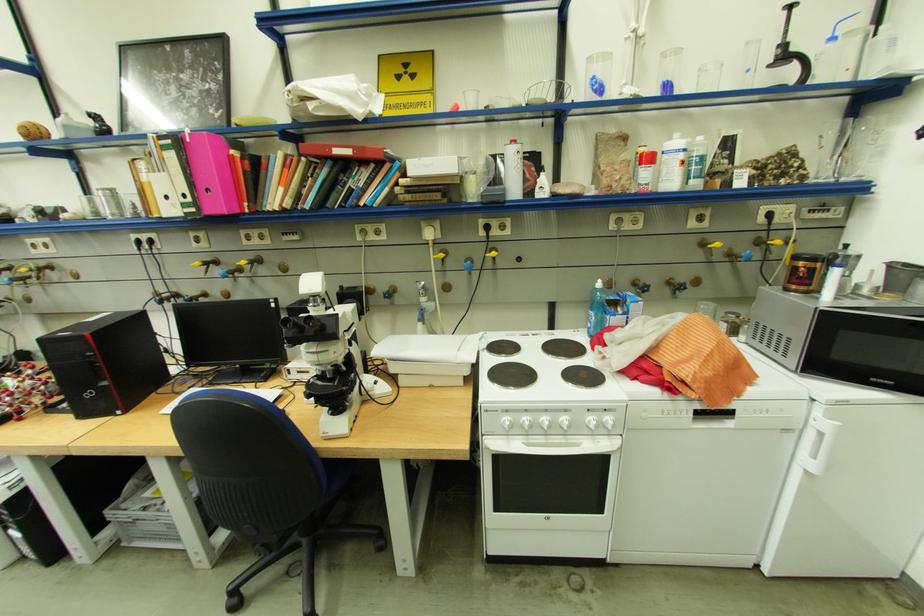
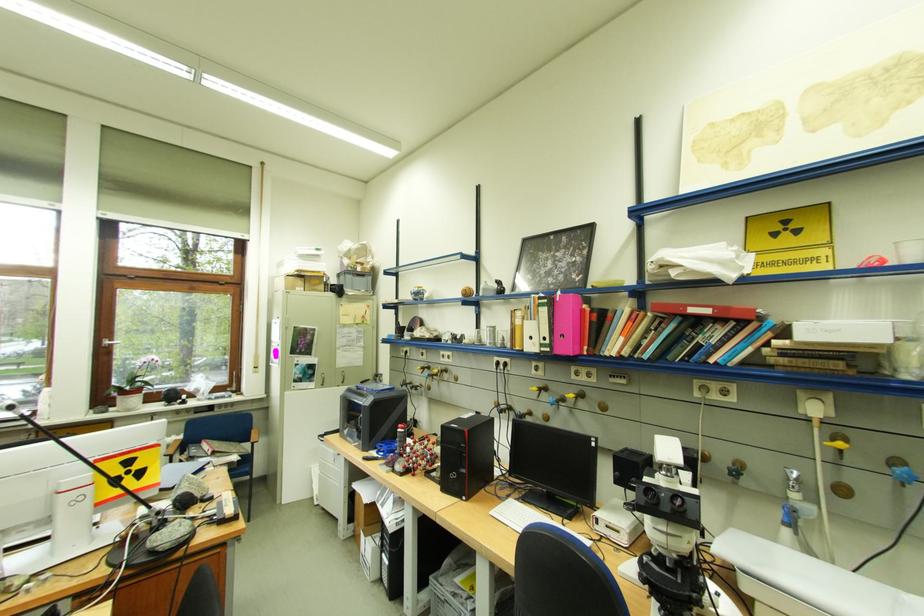
Question: The images are taken continuously from a first-person perspective. In which direction is your viewpoint rotating?

Choices:
 (A) Left
 (B) Right
 (C) Up
 (D) Down

Answer: (A)